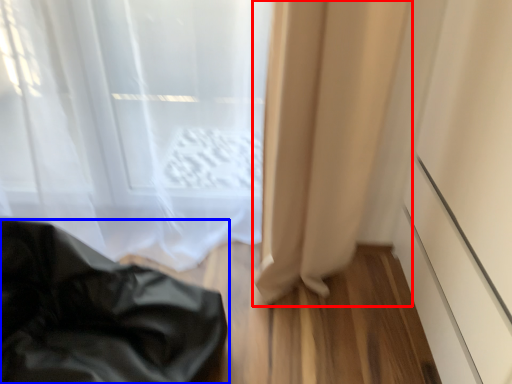
Question: Which object is further to the camera taking this photo, curtain (highlighted by a red box) or furniture (highlighted by a blue box)?

Choices:
 (A) curtain
 (B) furniture

Answer: (A)